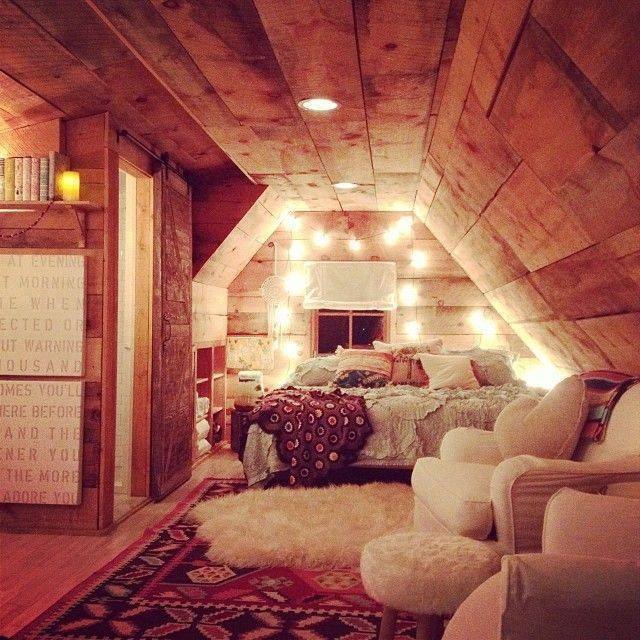
The width and height of the screenshot is (640, 640). What are the coordinates of `recliner` in the screenshot? It's located at (456, 484), (539, 570).